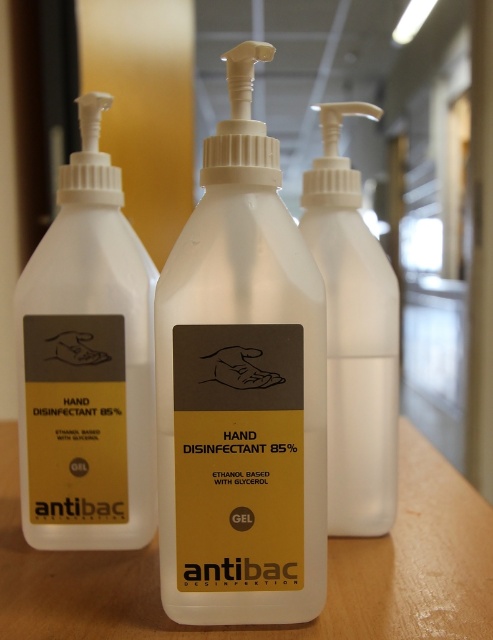
Is white matte hand sanitizer at center bigger than matte white hand sanitizer at left?

Yes, white matte hand sanitizer at center is bigger than matte white hand sanitizer at left.

Does point (179, 388) come in front of point (68, 458)?

Yes, it is in front of point (68, 458).

The width and height of the screenshot is (493, 640). What are the coordinates of `white matte hand sanitizer at center` in the screenshot? It's located at (241, 390).

Who is more distant from viewer, (78,232) or (103,554)?

The point (103,554) is more distant.

Is point (68, 189) positioned behind point (155, 540)?

No, it is in front of (155, 540).

Measure the distance between matte white hand sanitizer at left and camera.

matte white hand sanitizer at left and camera are 37.05 inches apart.

Where is `matte white hand sanitizer at left`? The height and width of the screenshot is (640, 493). matte white hand sanitizer at left is located at coordinates (87, 364).

Does matte white hand sanitizer at left appear under white plastic hand sanitizer at center?

Correct, matte white hand sanitizer at left is located below white plastic hand sanitizer at center.

Does matte white hand sanitizer at left appear on the right side of white plastic hand sanitizer at center?

In fact, matte white hand sanitizer at left is to the left of white plastic hand sanitizer at center.

Between point (82, 198) and point (395, 422), which one is positioned in front?

Positioned in front is point (82, 198).

This screenshot has width=493, height=640. Identify the location of matte white hand sanitizer at left. (87, 364).